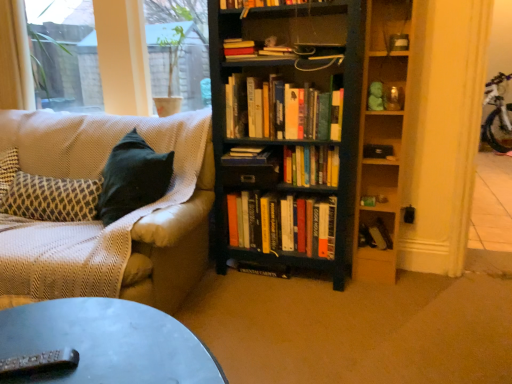
Locate an element on the screen. Image resolution: width=512 pixels, height=384 pixels. vacant space that is in between wooden shelves at right, placed as the first shelf when sorted from bottom to top, and dark wood bookcase at center is located at coordinates (374, 283).